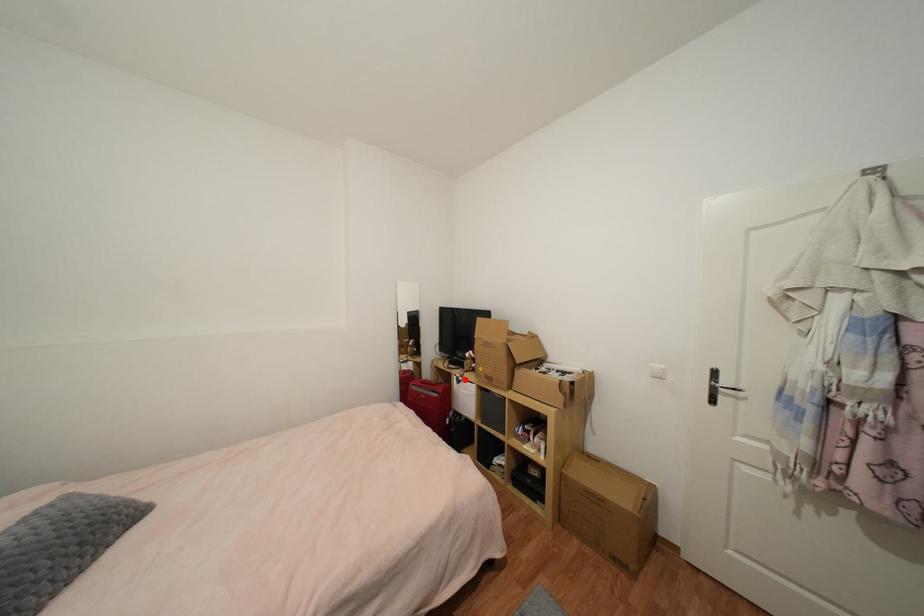
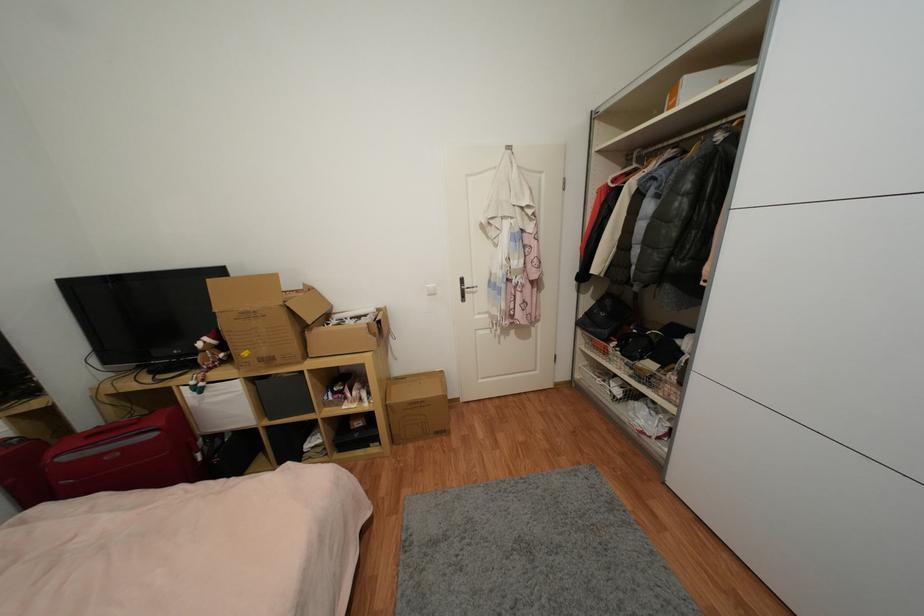
Question: I am providing you with two images of the same scene from different viewpoints. A red point is shown in image1. For the corresponding object point in image2, is it positioned nearer or farther from the camera?

Choices:
 (A) Nearer
 (B) Farther

Answer: (A)